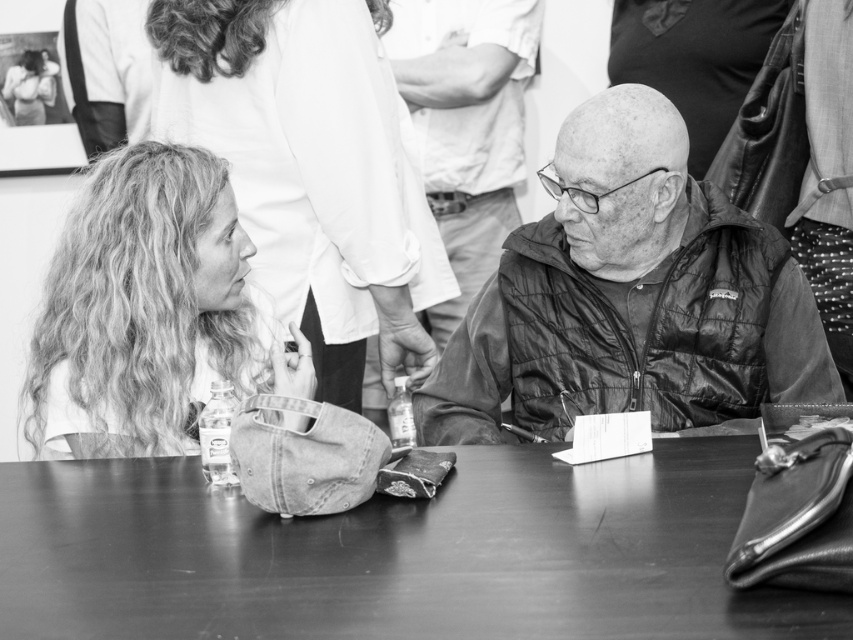
You are organizing a clothing display and need to place the quilted black jacket at center and the leather jacket at center on a rack. The rack has a maximum spacing capacity of 3 feet between items. Can both jackets be placed on the rack without exceeding the spacing limit?

The quilted black jacket at center and leather jacket at center are 3.53 feet apart from each other, which exceeds the rack maximum spacing capacity of 3 feet. Therefore, they cannot be placed on the rack without exceeding the spacing limit.

You are standing at the position of point (160, 304) and want to move to the position of point (461, 512). According to the scene, is the path between these two points clear of any obstacles?

Point (461, 512) is in front of point (160, 304), so the path between them is clear of obstacles.